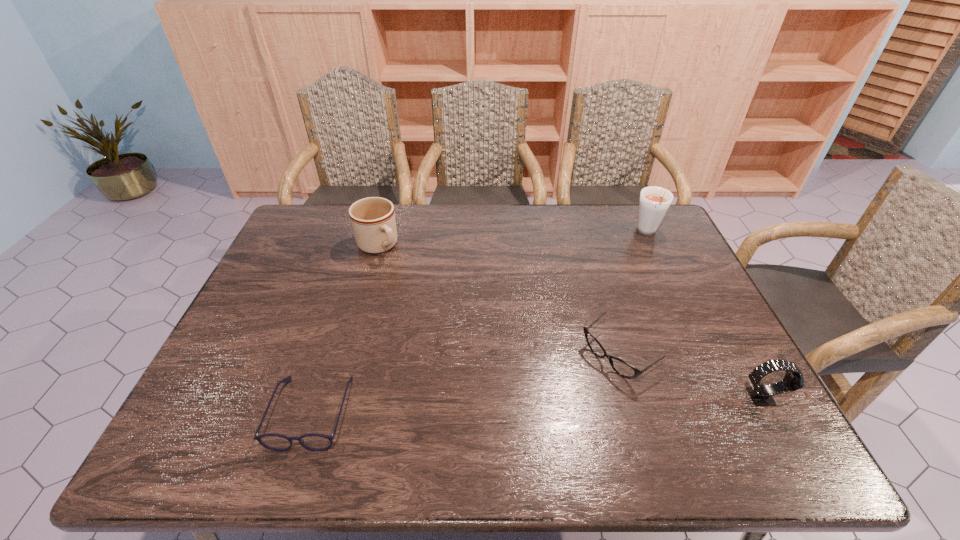
The width and height of the screenshot is (960, 540). I want to click on object that is positioned at the near right corner, so click(761, 395).

This screenshot has height=540, width=960. In the image, there is a desktop. Identify the location of vacant space at the far edge. (491, 234).

The height and width of the screenshot is (540, 960). Find the location of `free region at the near edge of the desktop`. free region at the near edge of the desktop is located at coordinates (503, 406).

What are the coordinates of `vacant space at the left edge` in the screenshot? It's located at (207, 375).

This screenshot has width=960, height=540. What are the coordinates of `free space at the right edge of the desktop` in the screenshot? It's located at (670, 258).

Where is `free space at the far left corner`? free space at the far left corner is located at coordinates (331, 234).

Identify the location of vacant space at the near left corner. Image resolution: width=960 pixels, height=540 pixels. (221, 394).

Identify the location of free space between the watch and the tallest object. (705, 314).

This screenshot has height=540, width=960. What are the coordinates of `vacant area between the right spectacles and the watch` in the screenshot? It's located at (689, 376).

I want to click on vacant area between the right spectacles and the mug, so click(498, 301).